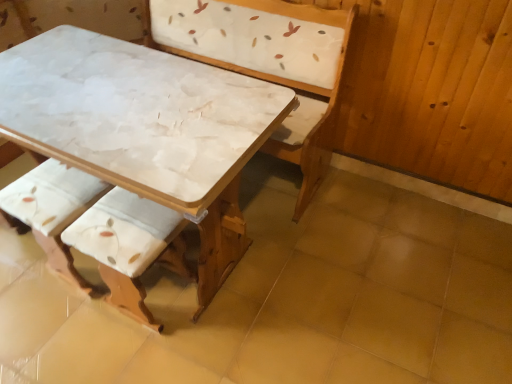
This screenshot has height=384, width=512. Identify the location of vacant region to the left of white fabric cushion at lower left, arranged as the 1th armchair when viewed from the left. (21, 269).